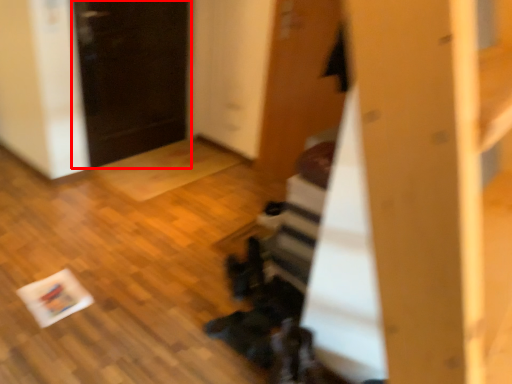
Question: From the image, what is the correct spatial relationship of door (annotated by the red box) in relation to door?

Choices:
 (A) left
 (B) right

Answer: (A)